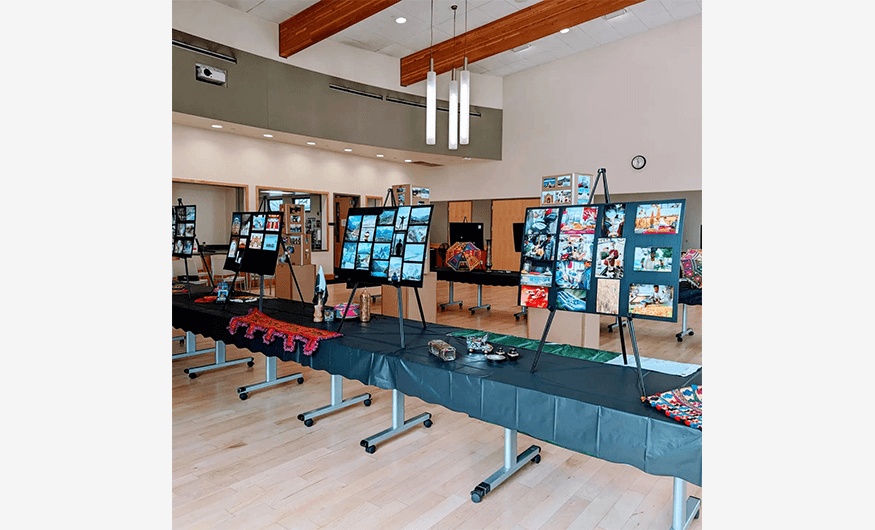
Find the location of a particular element. Image resolution: width=875 pixels, height=530 pixels. wall is located at coordinates (229, 161), (645, 128).